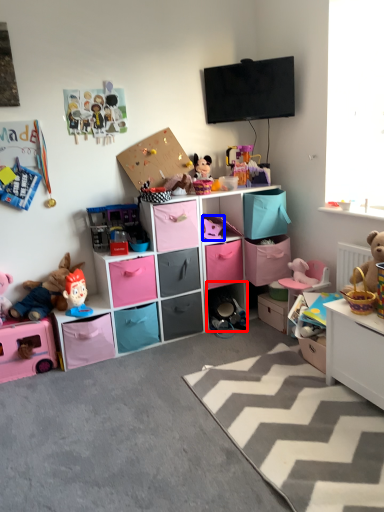
Question: Which of the following is the closest to the observer, cabinet (highlighted by a red box) or toy (highlighted by a blue box)?

Choices:
 (A) cabinet
 (B) toy

Answer: (B)